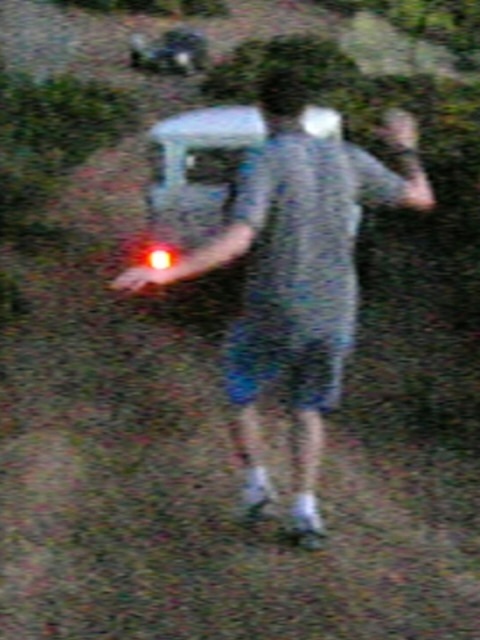
Consider the image. You are standing in a park and see a person holding a glowing object. You notice a matte gray shirt at center and a white plastic car at center. Which object is closer to you?

The matte gray shirt at center is closer to the viewer than the white plastic car at center.

You are trying to determine if the matte gray shirt at center can completely cover the white plastic car at center. Based on their widths, what do you think?

The matte gray shirt at center might be wider than white plastic car at center, so it could potentially cover it depending on the exact dimensions.